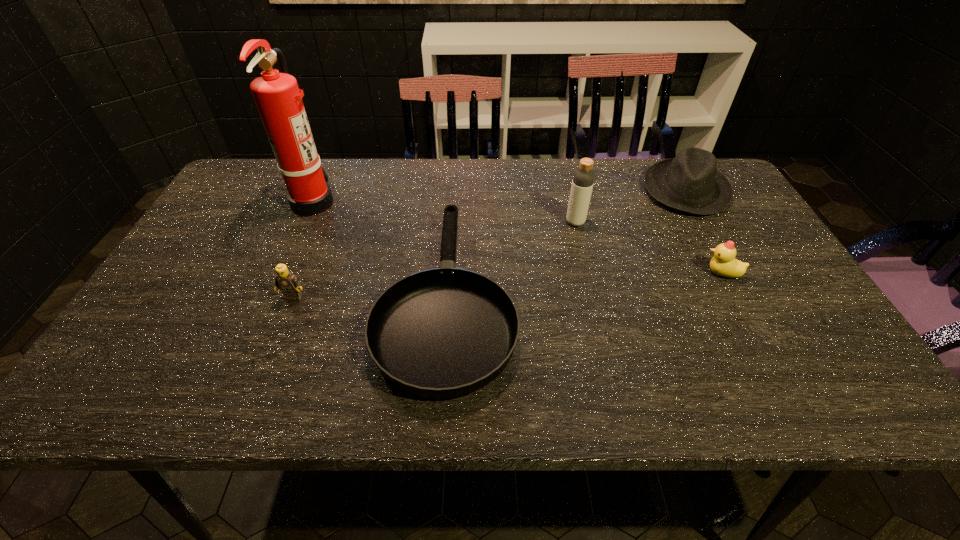
What are the coordinates of `free location that satisfies the following two spatial constraints: 1. on the front-facing side of the duckling; 2. in front of the Lego` in the screenshot? It's located at (734, 297).

The width and height of the screenshot is (960, 540). What are the coordinates of `vacant region that satisfies the following two spatial constraints: 1. at the end of the handle of the frying pan; 2. at the nozzle of the tallest object` in the screenshot? It's located at (454, 201).